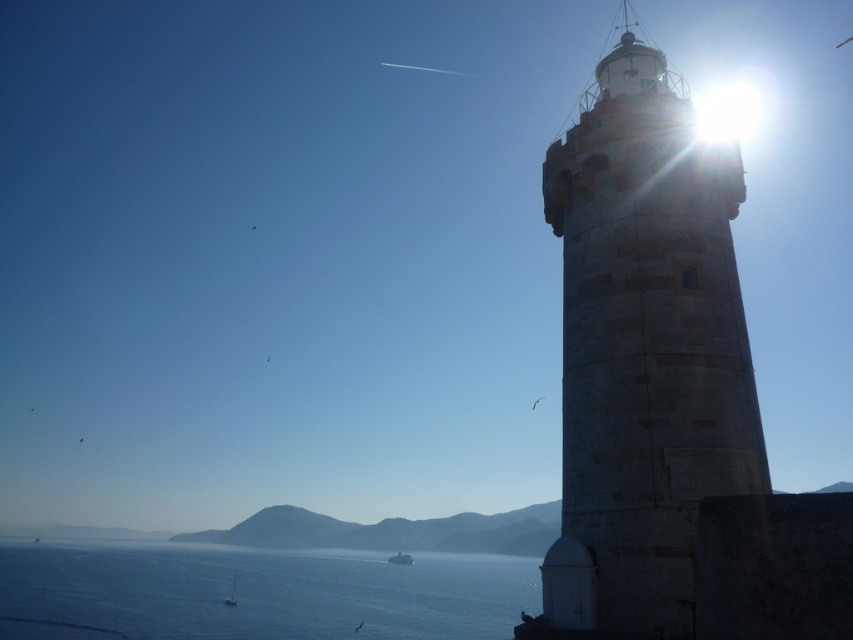
Is point (688, 433) less distant than point (234, 577)?

Yes.

Who is positioned more to the right, stone textured lighthouse at right or white plastic boat at lower left?

stone textured lighthouse at right is more to the right.

Which is in front, point (747, 348) or point (233, 604)?

Point (747, 348) is more forward.

At what (x,y) coordinates should I click in order to perform the action: click on stone textured lighthouse at right. Please return your answer as a coordinate pair (x, y). This screenshot has width=853, height=640. Looking at the image, I should click on (643, 352).

Between white plastic boat at lower center and white plastic boat at lower left, which one is positioned higher?

white plastic boat at lower left is above.

Does white plastic boat at lower center lie behind white plastic boat at lower left?

Yes, white plastic boat at lower center is behind white plastic boat at lower left.

This screenshot has width=853, height=640. I want to click on white plastic boat at lower center, so click(x=399, y=557).

Does stone textured lighthouse at right have a greater width compared to blue water at lower center?

Incorrect, stone textured lighthouse at right's width does not surpass blue water at lower center's.

Is stone textured lighthouse at right above blue water at lower center?

Correct, stone textured lighthouse at right is located above blue water at lower center.

Which is in front, point (583, 218) or point (486, 620)?

Point (583, 218)

In order to click on stone textured lighthouse at right in this screenshot , I will do `click(643, 352)`.